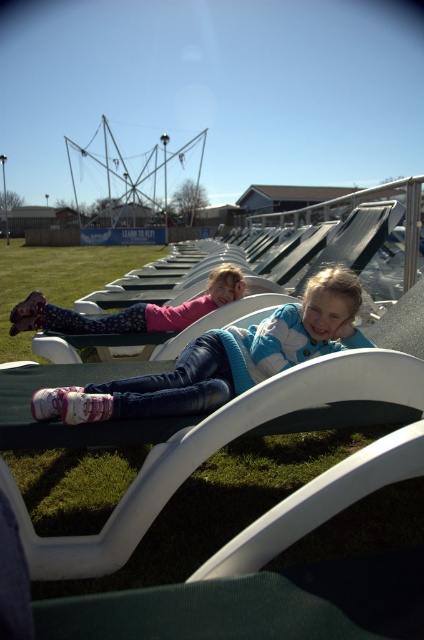
Who is shorter, blue striped sweater at center or green grass at center?

A: blue striped sweater at center

Does point (114, 406) come farther from viewer compared to point (83, 273)?

That is False.

Locate an element on the screen. blue striped sweater at center is located at coordinates (222, 360).

Can you confirm if green grass at center is bigger than matte pink sweater at center?

Indeed, green grass at center has a larger size compared to matte pink sweater at center.

Can you confirm if green grass at center is positioned above matte pink sweater at center?

Correct, green grass at center is located above matte pink sweater at center.

You are a GUI agent. You are given a task and a screenshot of the screen. Output one action in this format:
    pyautogui.click(x=<x>, y=<y>)
    Task: Click on the green grass at center
    The image size is (424, 640).
    Given the screenshot: What is the action you would take?
    pyautogui.click(x=56, y=278)

Does blue striped sweater at center appear over matte pink sweater at center?

Actually, blue striped sweater at center is below matte pink sweater at center.

Who is shorter, blue striped sweater at center or matte pink sweater at center?

Standing shorter between the two is matte pink sweater at center.

At what (x,y) coordinates should I click in order to perform the action: click on blue striped sweater at center. Please return your answer as a coordinate pair (x, y). Looking at the image, I should click on (222, 360).